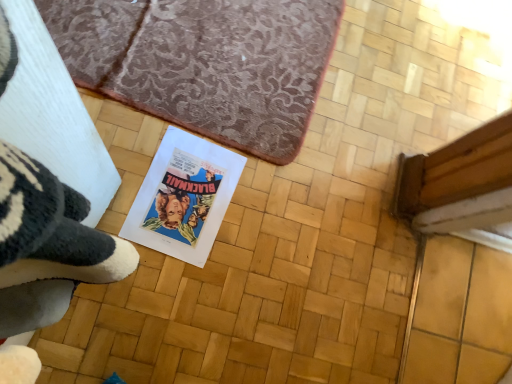
Question: Does matte paper book at center appear on the right side of brown textured rug at upper center?

Choices:
 (A) no
 (B) yes

Answer: (A)

Question: Is matte paper book at center to the left of brown textured rug at upper center from the viewer's perspective?

Choices:
 (A) no
 (B) yes

Answer: (B)

Question: Is matte paper book at center positioned with its back to brown textured rug at upper center?

Choices:
 (A) yes
 (B) no

Answer: (A)

Question: Can brown textured rug at upper center be found inside matte paper book at center?

Choices:
 (A) no
 (B) yes

Answer: (A)

Question: Is matte paper book at center further to the viewer compared to brown textured rug at upper center?

Choices:
 (A) no
 (B) yes

Answer: (A)

Question: Considering the relative sizes of matte paper book at center and brown textured rug at upper center in the image provided, is matte paper book at center smaller than brown textured rug at upper center?

Choices:
 (A) yes
 (B) no

Answer: (A)

Question: Is brown textured rug at upper center smaller than matte paper book at center?

Choices:
 (A) yes
 (B) no

Answer: (B)

Question: Considering the relative sizes of brown textured rug at upper center and matte paper book at center in the image provided, is brown textured rug at upper center wider than matte paper book at center?

Choices:
 (A) no
 (B) yes

Answer: (B)

Question: From the image's perspective, would you say brown textured rug at upper center is positioned over matte paper book at center?

Choices:
 (A) yes
 (B) no

Answer: (A)

Question: Considering the relative sizes of brown textured rug at upper center and matte paper book at center in the image provided, is brown textured rug at upper center bigger than matte paper book at center?

Choices:
 (A) yes
 (B) no

Answer: (A)

Question: Is the position of brown textured rug at upper center less distant than that of matte paper book at center?

Choices:
 (A) no
 (B) yes

Answer: (A)

Question: Could matte paper book at center be considered to be inside brown textured rug at upper center?

Choices:
 (A) no
 (B) yes

Answer: (A)

Question: Would you say matte paper book at center is to the left or to the right of brown textured rug at upper center in the picture?

Choices:
 (A) right
 (B) left

Answer: (B)